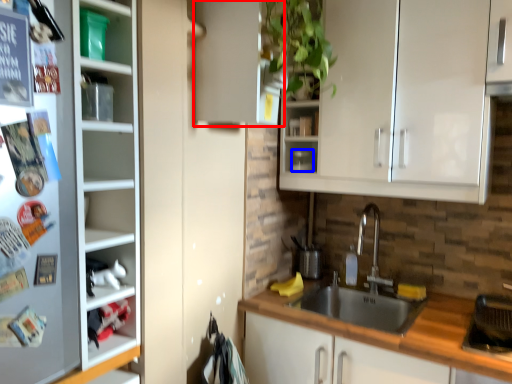
Question: Which of the following is the farthest to the observer, cabinetry (highlighted by a red box) or appliance (highlighted by a blue box)?

Choices:
 (A) cabinetry
 (B) appliance

Answer: (B)